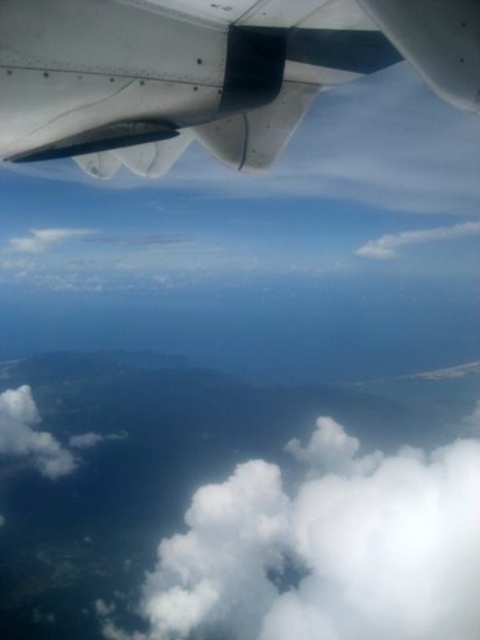
Can you confirm if metallic gray wing at upper left is shorter than white fluffy cloud at lower center?

Indeed, metallic gray wing at upper left has a lesser height compared to white fluffy cloud at lower center.

Can you confirm if metallic gray wing at upper left is taller than white fluffy cloud at lower center?

Incorrect, metallic gray wing at upper left's height is not larger of white fluffy cloud at lower center's.

You are a GUI agent. You are given a task and a screenshot of the screen. Output one action in this format:
    pyautogui.click(x=<x>, y=<y>)
    Task: Click on the metallic gray wing at upper left
    The height and width of the screenshot is (640, 480).
    Given the screenshot: What is the action you would take?
    pyautogui.click(x=205, y=72)

Locate an element on the screen. The image size is (480, 640). metallic gray wing at upper left is located at coordinates (205, 72).